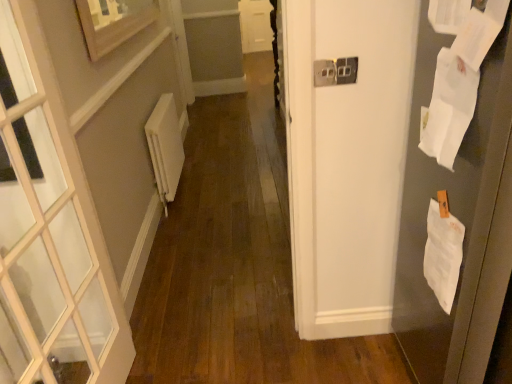
Question: Considering the relative sizes of white paper at right and white matte radiator at left in the image provided, is white paper at right wider than white matte radiator at left?

Choices:
 (A) yes
 (B) no

Answer: (A)

Question: Can you confirm if white paper at right is smaller than white matte radiator at left?

Choices:
 (A) yes
 (B) no

Answer: (B)

Question: Is white paper at right oriented away from white matte radiator at left?

Choices:
 (A) no
 (B) yes

Answer: (A)

Question: Considering the relative positions of white paper at right and white matte radiator at left in the image provided, is white paper at right behind white matte radiator at left?

Choices:
 (A) yes
 (B) no

Answer: (B)

Question: Is white paper at right positioned beyond the bounds of white matte radiator at left?

Choices:
 (A) yes
 (B) no

Answer: (A)

Question: Considering the positions of white paper at right, the 1th paper in the bottom-to-top sequence, and white plastic electric outlet at upper center in the image, is white paper at right, the 1th paper in the bottom-to-top sequence, taller or shorter than white plastic electric outlet at upper center?

Choices:
 (A) short
 (B) tall

Answer: (B)

Question: From the image's perspective, is white paper at right, the 1th paper in the bottom-to-top sequence, located above or below white plastic electric outlet at upper center?

Choices:
 (A) below
 (B) above

Answer: (A)

Question: Does point tap(437, 228) appear closer or farther from the camera than point tap(340, 79)?

Choices:
 (A) closer
 (B) farther

Answer: (A)

Question: From a real-world perspective, is white paper at right, the 1th paper in the bottom-to-top sequence, physically located above or below white plastic electric outlet at upper center?

Choices:
 (A) below
 (B) above

Answer: (A)

Question: Considering the positions of wooden picture frame at upper left and white plastic electric outlet at upper center in the image, is wooden picture frame at upper left wider or thinner than white plastic electric outlet at upper center?

Choices:
 (A) thin
 (B) wide

Answer: (B)

Question: Considering their positions, is wooden picture frame at upper left located in front of or behind white plastic electric outlet at upper center?

Choices:
 (A) front
 (B) behind

Answer: (B)

Question: In terms of size, does wooden picture frame at upper left appear bigger or smaller than white plastic electric outlet at upper center?

Choices:
 (A) small
 (B) big

Answer: (B)

Question: Based on their positions, is wooden picture frame at upper left located to the left or right of white plastic electric outlet at upper center?

Choices:
 (A) left
 (B) right

Answer: (A)

Question: Is white paper at upper right, arranged as the third paper when ordered from the bottom, inside or outside of wooden picture frame at upper left?

Choices:
 (A) outside
 (B) inside

Answer: (A)

Question: Is white paper at upper right, which is the 1th paper in top-to-bottom order, to the left or to the right of wooden picture frame at upper left in the image?

Choices:
 (A) left
 (B) right

Answer: (B)